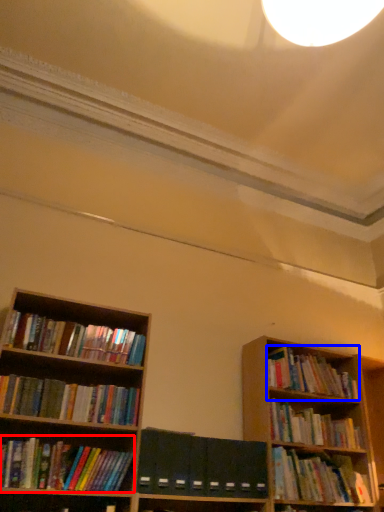
Question: Which object is closer to the camera taking this photo, book (highlighted by a red box) or book (highlighted by a blue box)?

Choices:
 (A) book
 (B) book

Answer: (A)